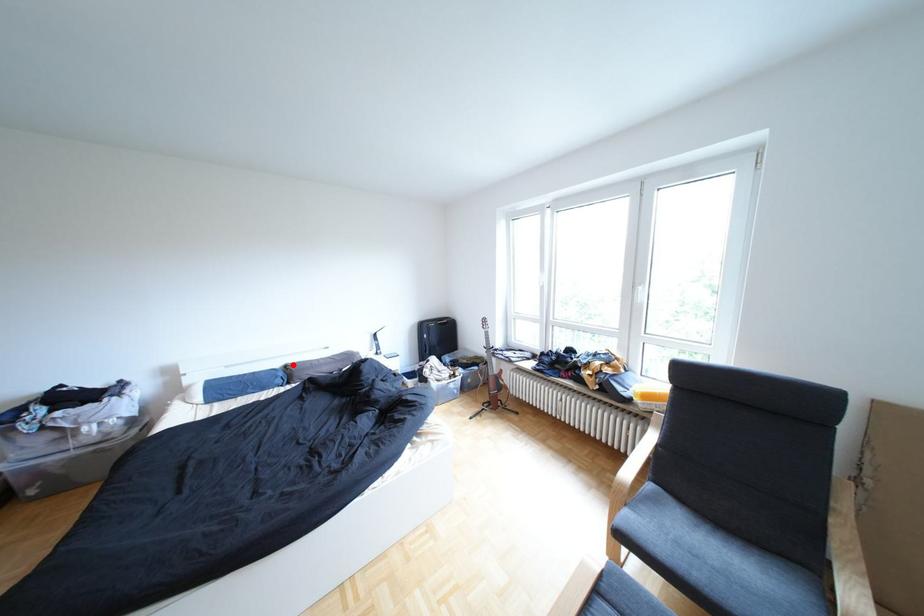
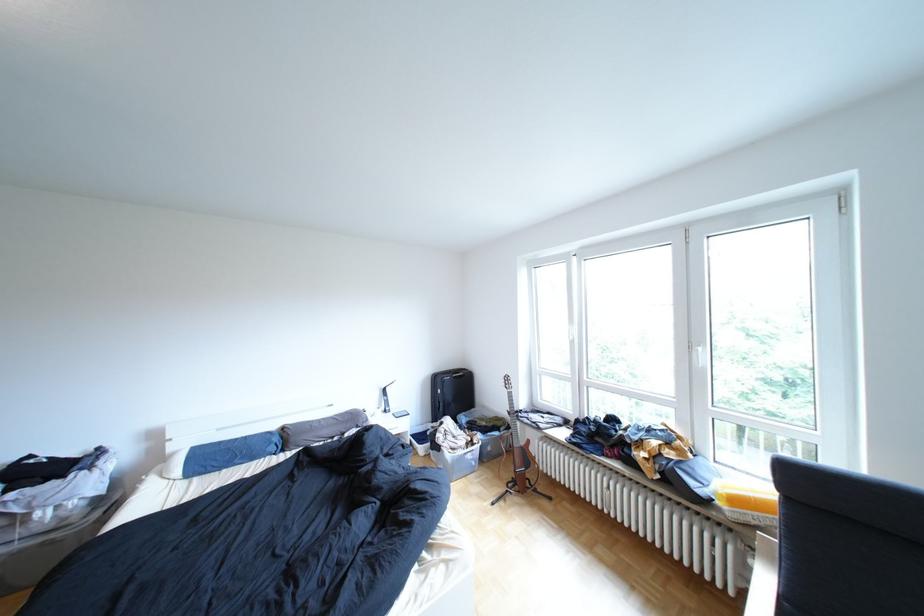
Where in the second image is the point corresponding to the highlighted location from the first image?

(289, 427)